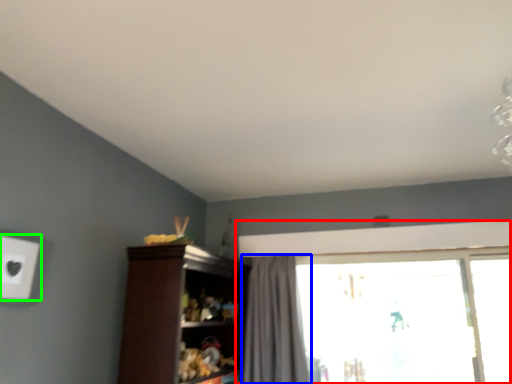
Question: Which object is the closest to the window (highlighted by a red box)? Choose among these: curtain (highlighted by a blue box) or electric outlet (highlighted by a green box).

Choices:
 (A) curtain
 (B) electric outlet

Answer: (A)